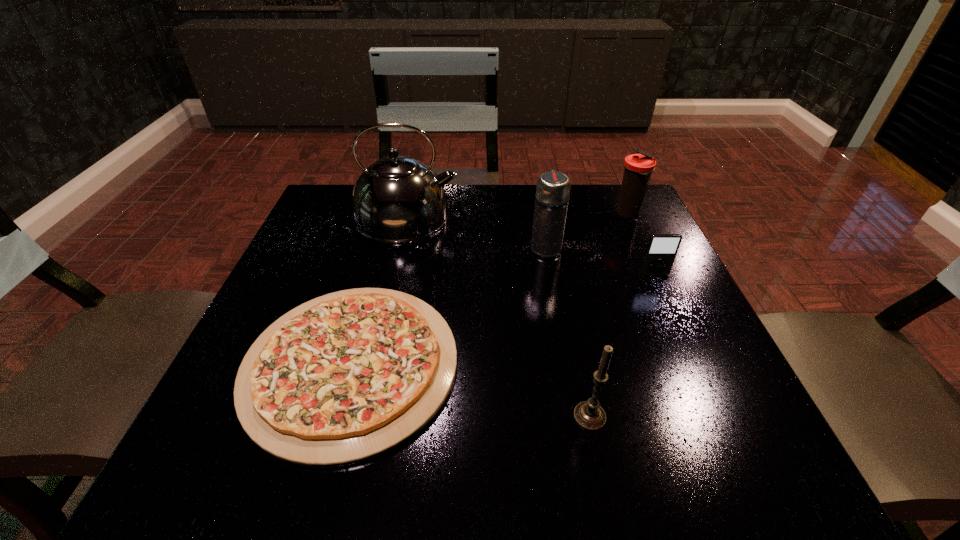
In the image, there is a desktop. Identify the location of free space at the near right corner. (652, 430).

I want to click on unoccupied position between the iPod and the shortest object, so click(x=502, y=319).

Find the location of a particular element. The image size is (960, 540). vacant space that is in between the candle and the pizza is located at coordinates (470, 390).

You are a GUI agent. You are given a task and a screenshot of the screen. Output one action in this format:
    pyautogui.click(x=<x>, y=<y>)
    Task: Click on the free spot between the nearer thermos bottle and the candle
    This screenshot has width=960, height=540.
    Given the screenshot: What is the action you would take?
    pyautogui.click(x=567, y=332)

At what (x,y) coordinates should I click in order to perform the action: click on blank region between the nearer thermos bottle and the iPod. Please return your answer as a coordinate pair (x, y). Looking at the image, I should click on (600, 261).

You are a GUI agent. You are given a task and a screenshot of the screen. Output one action in this format:
    pyautogui.click(x=<x>, y=<y>)
    Task: Click on the free point between the shortest object and the candle
    
    Given the screenshot: What is the action you would take?
    pyautogui.click(x=470, y=390)

Where is `empty space between the left thermos bottle and the second shortest object`? empty space between the left thermos bottle and the second shortest object is located at coordinates (600, 261).

Locate an element on the screen. free space between the fifth tallest object and the candle is located at coordinates (622, 345).

You are a GUI agent. You are given a task and a screenshot of the screen. Output one action in this format:
    pyautogui.click(x=<x>, y=<y>)
    Task: Click on the vacant area that lies between the right thermos bottle and the nearer thermos bottle
    The width and height of the screenshot is (960, 540).
    Given the screenshot: What is the action you would take?
    pyautogui.click(x=588, y=231)

You are a GUI agent. You are given a task and a screenshot of the screen. Output one action in this format:
    pyautogui.click(x=<x>, y=<y>)
    Task: Click on the free space between the second shortest object and the shortest object
    The width and height of the screenshot is (960, 540).
    Given the screenshot: What is the action you would take?
    point(502,319)